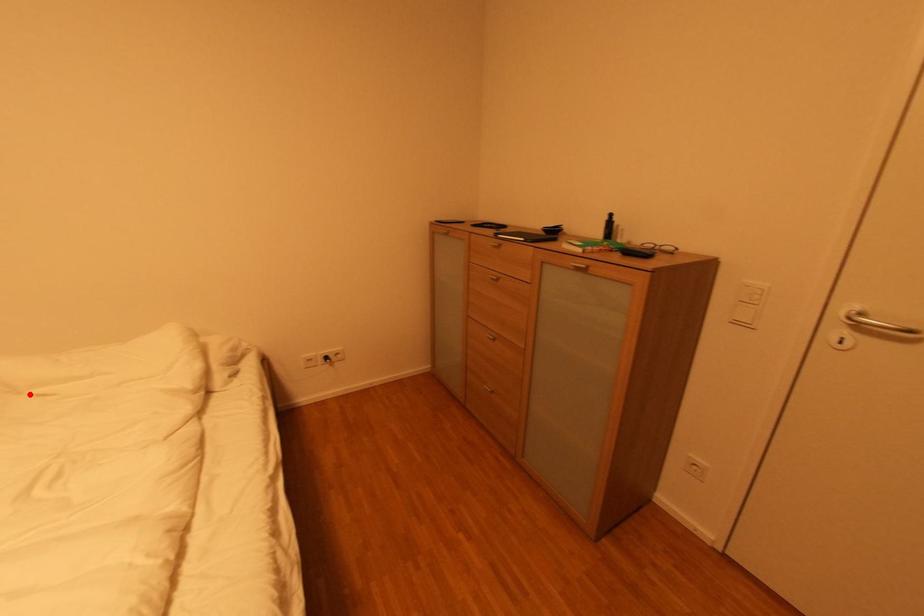
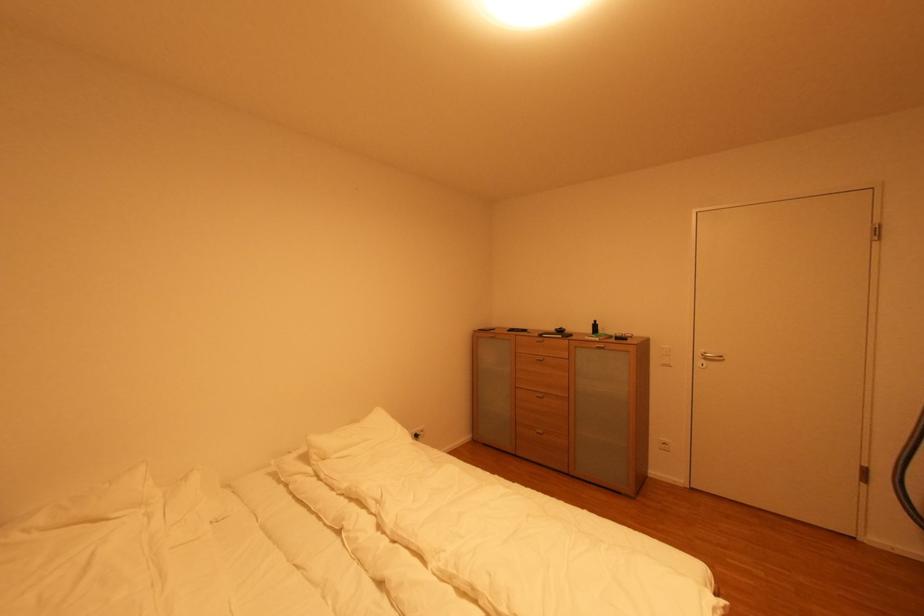
In the second image, find the point that corresponds to the highlighted location in the first image.

(330, 461)